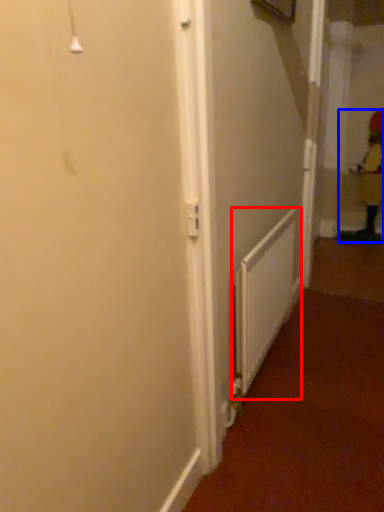
Question: Which of the following is the closest to the observer, radiator (highlighted by a red box) or worker (highlighted by a blue box)?

Choices:
 (A) radiator
 (B) worker

Answer: (A)